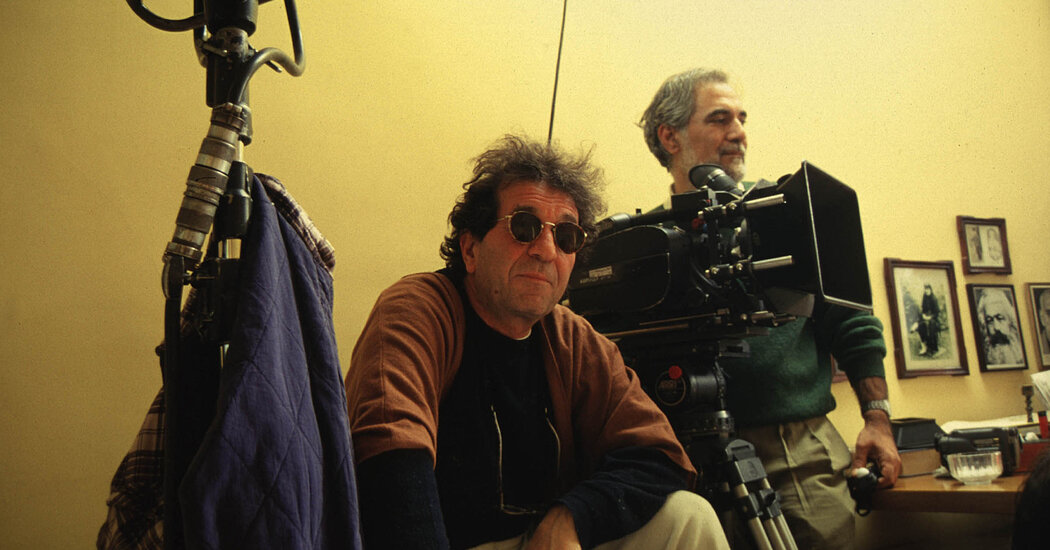
The image size is (1050, 550). I want to click on light stand is partially covered with a blanket, so click(231, 181), click(252, 341).